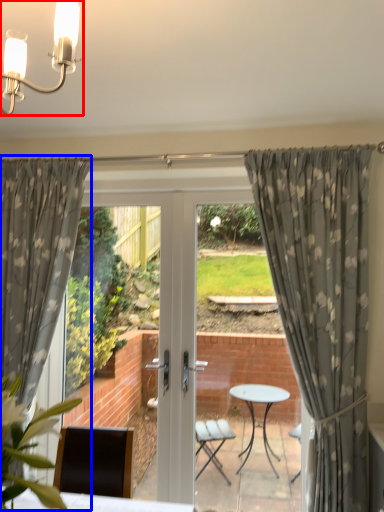
Question: Which object appears closest to the camera in this image, light fixture (highlighted by a red box) or curtain (highlighted by a blue box)?

Choices:
 (A) light fixture
 (B) curtain

Answer: (A)